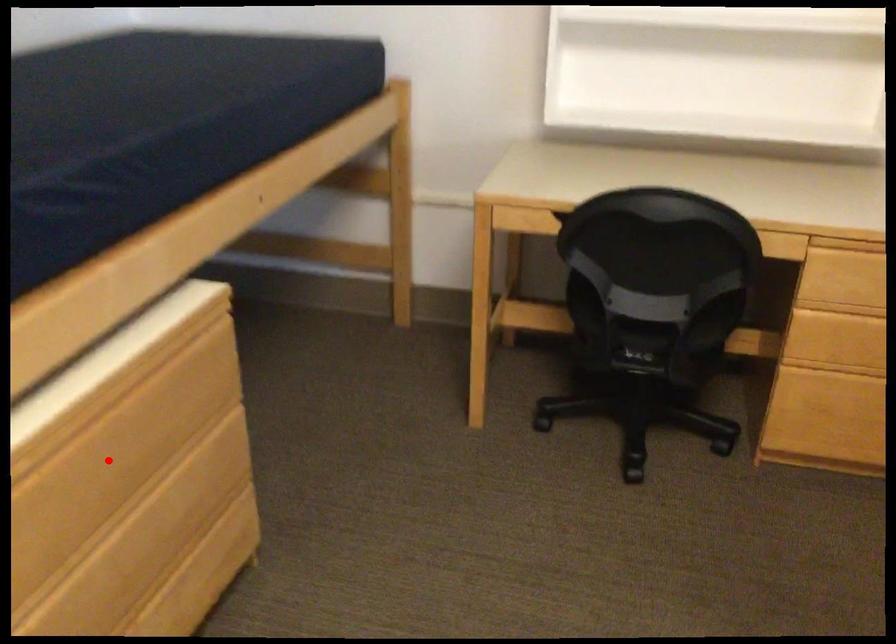
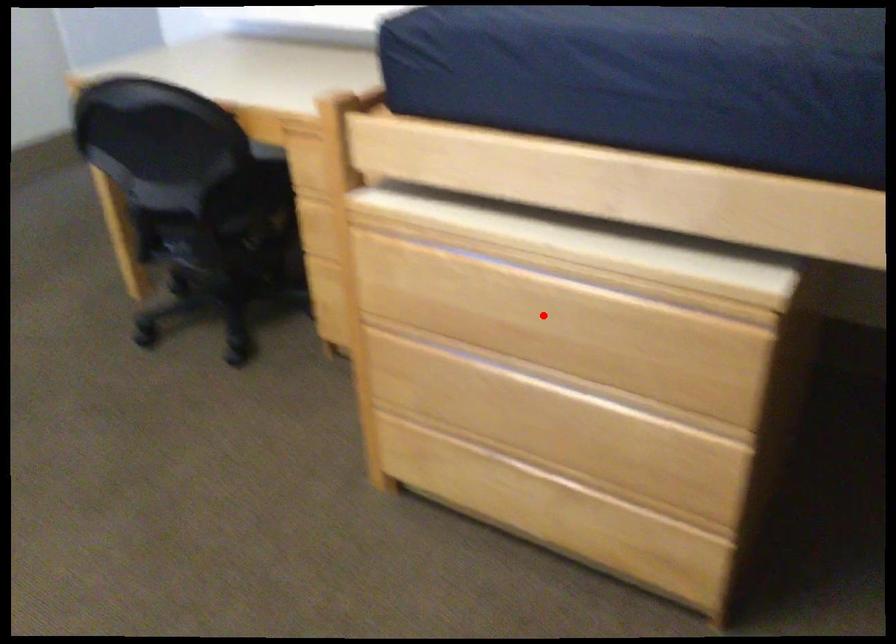
I am providing you with two images of the same scene from different viewpoints. A red point is marked on the first image and another point is marked on the second image. Does the point marked in image1 correspond to the same location as the one in image2?

Yes